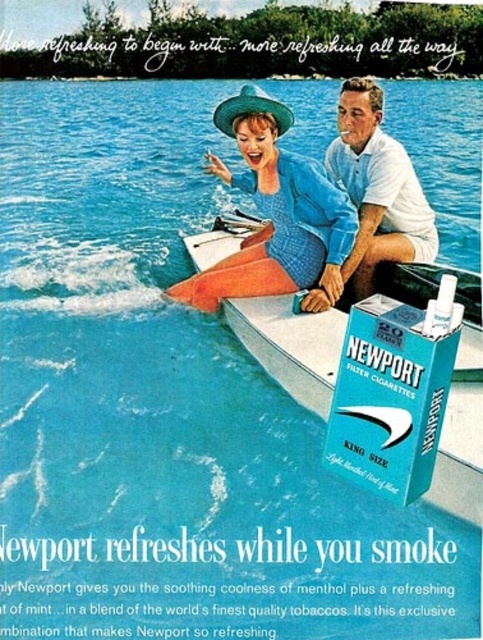
You are a photographer trying to capture the blue textured dress at center and the white plastic boat at center in a single shot. Based on their positions, which object is closer to the camera?

The blue textured dress at center is closer to the camera because the white plastic boat at center is behind it.

In the vintage Newport Filter Cigarettes advertisement, there is a white plastic boat at center and a white cotton shirt at center. From the perspective of someone looking at the image, which object is positioned more to the left?

The white plastic boat at center is positioned to the left of the white cotton shirt at center.

You are a photographer trying to capture a closeup of the two points in the image. Which point, point [463,392] or point [413,176], will appear larger in your photo?

Point [463,392] will appear larger in the photo because it is closer to the camera than point [413,176].